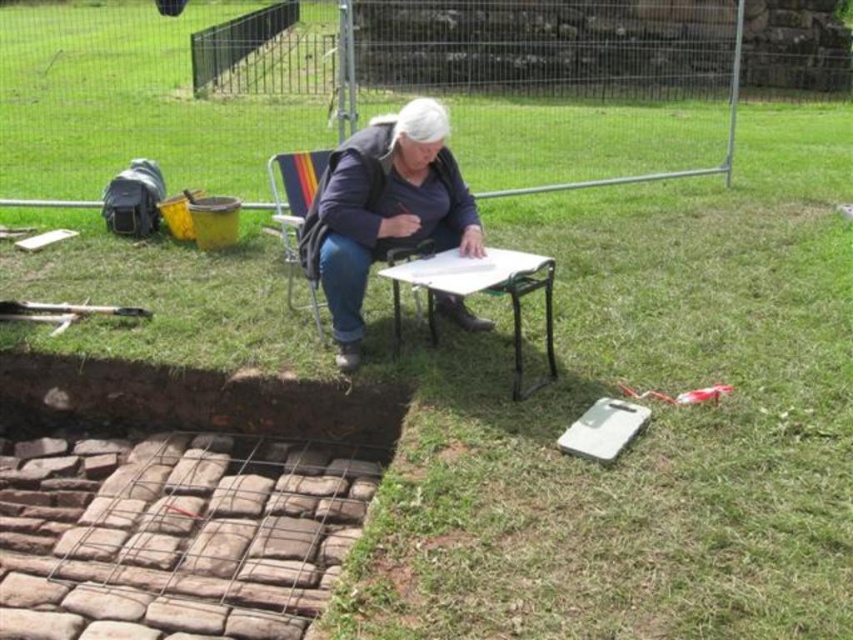
Question: Which point appears farthest from the camera in this image?

Choices:
 (A) (296, 259)
 (B) (456, 291)
 (C) (389, 192)

Answer: (A)

Question: Estimate the real-world distances between objects in this image. Which object is farther from the metallic folding chair at center?

Choices:
 (A) blue fabric jacket at center
 (B) white plastic table at center

Answer: (B)

Question: Estimate the real-world distances between objects in this image. Which object is closer to the white plastic table at center?

Choices:
 (A) blue fabric jacket at center
 (B) metallic folding chair at center

Answer: (A)

Question: From the image, what is the correct spatial relationship of blue fabric jacket at center in relation to white plastic table at center?

Choices:
 (A) below
 (B) above

Answer: (B)

Question: Does blue fabric jacket at center have a larger size compared to metallic folding chair at center?

Choices:
 (A) no
 (B) yes

Answer: (A)

Question: Observing the image, what is the correct spatial positioning of blue fabric jacket at center in reference to metallic folding chair at center?

Choices:
 (A) right
 (B) left

Answer: (A)